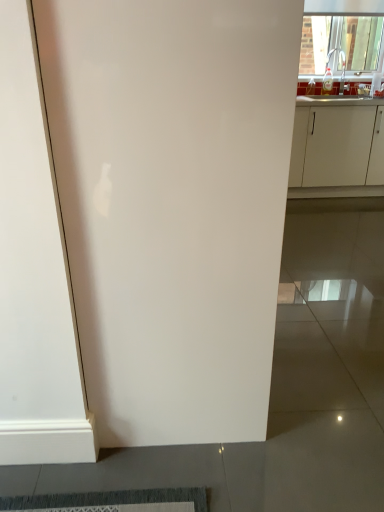
Question: Is white matte cabinet at right positioned beyond the bounds of transparent glass window at upper right?

Choices:
 (A) no
 (B) yes

Answer: (B)

Question: Is the depth of white matte cabinet at right greater than that of transparent glass window at upper right?

Choices:
 (A) yes
 (B) no

Answer: (B)

Question: Is white matte cabinet at right to the right of transparent glass window at upper right from the viewer's perspective?

Choices:
 (A) yes
 (B) no

Answer: (B)

Question: Is white matte cabinet at right turned away from transparent glass window at upper right?

Choices:
 (A) yes
 (B) no

Answer: (B)

Question: Is white matte cabinet at right taller than transparent glass window at upper right?

Choices:
 (A) no
 (B) yes

Answer: (B)

Question: In terms of height, does white matte cabinet at right look taller or shorter compared to transparent glass window at upper right?

Choices:
 (A) tall
 (B) short

Answer: (A)

Question: Do you think white matte cabinet at right is within transparent glass window at upper right, or outside of it?

Choices:
 (A) outside
 (B) inside

Answer: (A)

Question: Is white matte cabinet at right wider or thinner than transparent glass window at upper right?

Choices:
 (A) wide
 (B) thin

Answer: (A)

Question: Does point (301, 170) appear closer or farther from the camera than point (357, 36)?

Choices:
 (A) closer
 (B) farther

Answer: (A)

Question: In the image, is white glossy door at center positioned in front of or behind white matte cabinet at right?

Choices:
 (A) front
 (B) behind

Answer: (A)

Question: From a real-world perspective, is white glossy door at center physically located above or below white matte cabinet at right?

Choices:
 (A) below
 (B) above

Answer: (B)

Question: From the image's perspective, is white glossy door at center positioned above or below white matte cabinet at right?

Choices:
 (A) below
 (B) above

Answer: (A)

Question: Choose the correct answer: Is white glossy door at center inside white matte cabinet at right or outside it?

Choices:
 (A) inside
 (B) outside

Answer: (B)

Question: Is transparent glass window at upper right taller or shorter than white matte cabinet at right?

Choices:
 (A) tall
 (B) short

Answer: (B)

Question: Looking at their shapes, would you say transparent glass window at upper right is wider or thinner than white matte cabinet at right?

Choices:
 (A) thin
 (B) wide

Answer: (A)